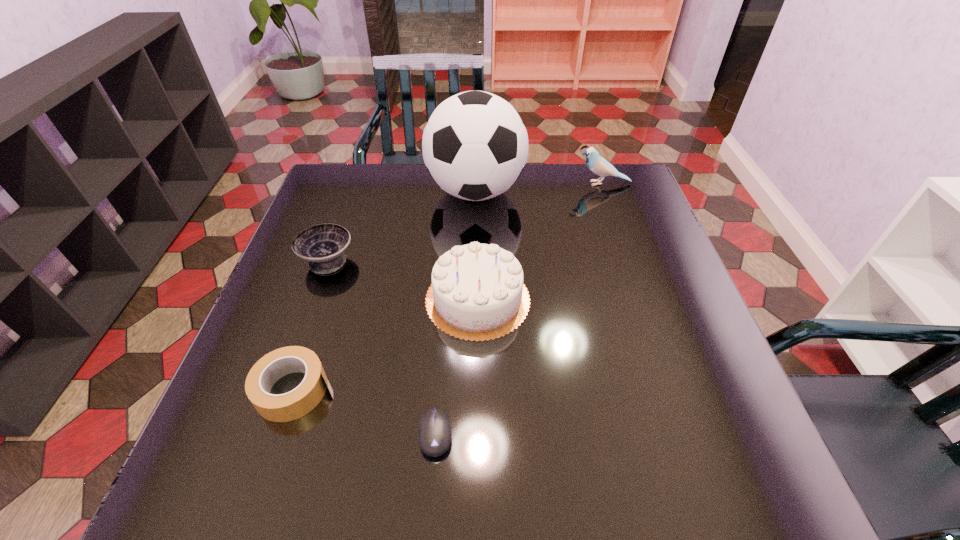
You are a GUI agent. You are given a task and a screenshot of the screen. Output one action in this format:
    pyautogui.click(x=<x>, y=<y>)
    Task: Click on the vacant area that lies between the soccer ball and the bowl
    
    Given the screenshot: What is the action you would take?
    pyautogui.click(x=401, y=226)

Where is `vacant area between the bird and the soccer ball`? The image size is (960, 540). vacant area between the bird and the soccer ball is located at coordinates (540, 187).

Where is `free space between the fifth tallest object and the computer mouse`? The image size is (960, 540). free space between the fifth tallest object and the computer mouse is located at coordinates (365, 411).

Where is `free space between the birthday cake and the rightmost object`? The height and width of the screenshot is (540, 960). free space between the birthday cake and the rightmost object is located at coordinates [540, 241].

Locate an element on the screen. The height and width of the screenshot is (540, 960). free point between the birthday cake and the rightmost object is located at coordinates (540, 241).

At what (x,y) coordinates should I click in order to perform the action: click on blank region between the fourth tallest object and the rightmost object. Please return your answer as a coordinate pair (x, y). Looking at the image, I should click on (465, 221).

Image resolution: width=960 pixels, height=540 pixels. Identify the location of free space that is in between the computer mouse and the duct tape. (365, 411).

Choose which object is the third nearest neighbor to the shortest object. Please provide its 2D coordinates. Your answer should be formatted as a tuple, i.e. [(x, y)], where the tuple contains the x and y coordinates of a point satisfying the conditions above.

[(323, 245)]

Identify which object is located as the fifth nearest to the rightmost object. Please provide its 2D coordinates. Your answer should be formatted as a tuple, i.e. [(x, y)], where the tuple contains the x and y coordinates of a point satisfying the conditions above.

[(298, 402)]

Locate an element on the screen. vacant area in the image that satisfies the following two spatial constraints: 1. at the edge of the computer mouse; 2. on the left side of the fifth tallest object is located at coordinates (279, 434).